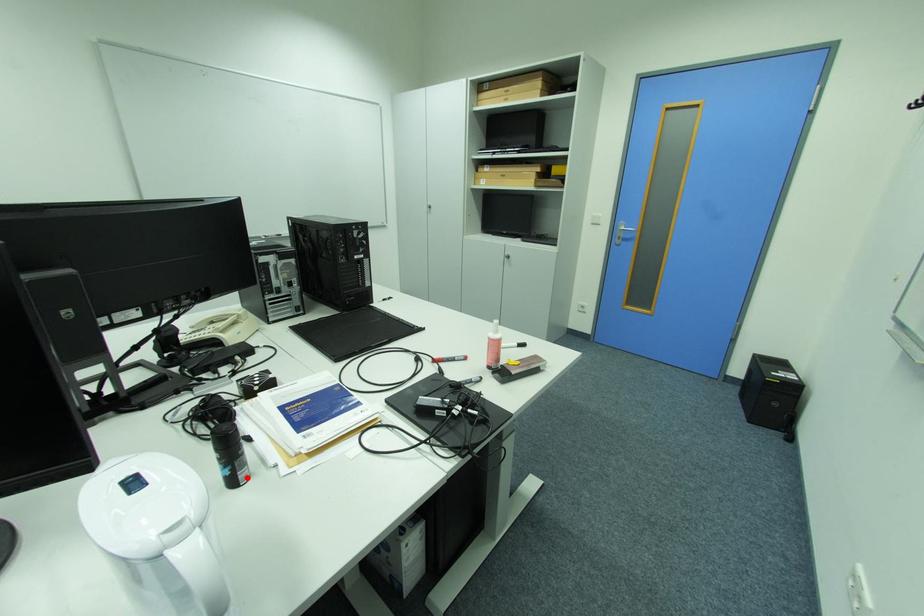
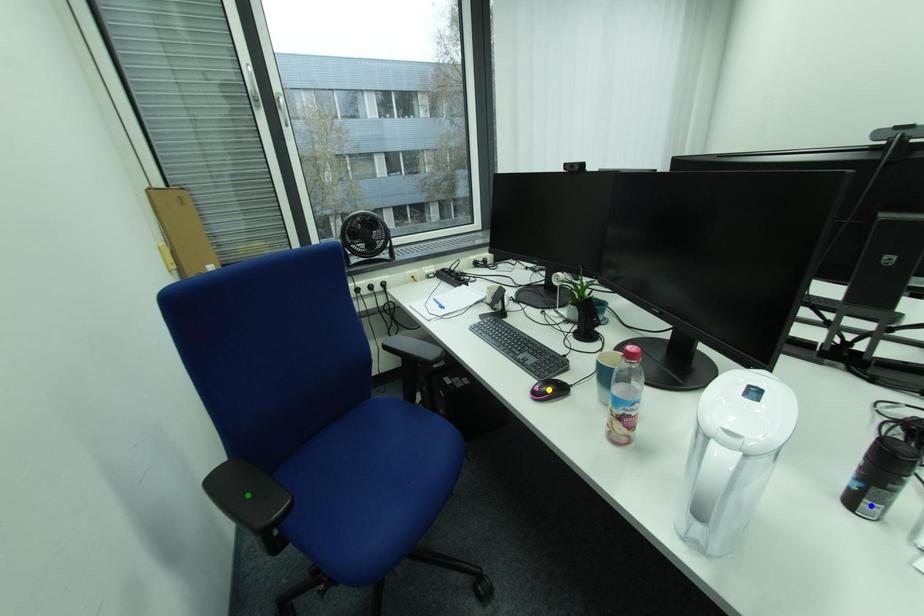
Question: I am providing you with two images of the same scene from different viewpoints. A red point is marked on the first image. You are given multiple points on the second image. In image 2, which mark is for the same physical point as the one in image 1?

Choices:
 (A) green point
 (B) blue point
 (C) yellow point

Answer: (B)